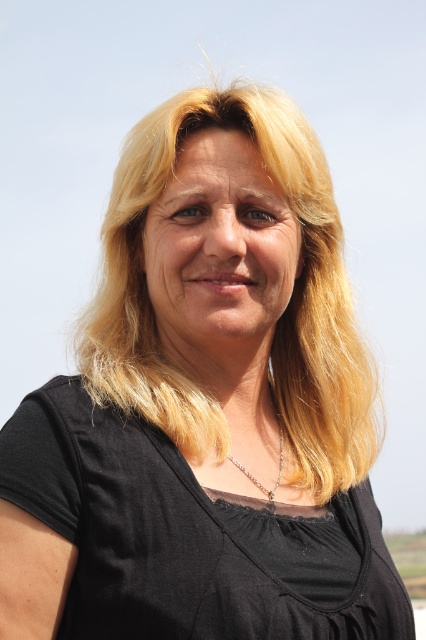
Question: Can you confirm if black matte dress at center is positioned to the left of silver metallic necklace at center?

Choices:
 (A) yes
 (B) no

Answer: (A)

Question: Which point appears farthest from the camera in this image?

Choices:
 (A) (273, 492)
 (B) (330, 637)

Answer: (A)

Question: Where is black matte dress at center located in relation to silver metallic necklace at center in the image?

Choices:
 (A) left
 (B) right

Answer: (A)

Question: Is black matte dress at center below silver metallic necklace at center?

Choices:
 (A) yes
 (B) no

Answer: (A)